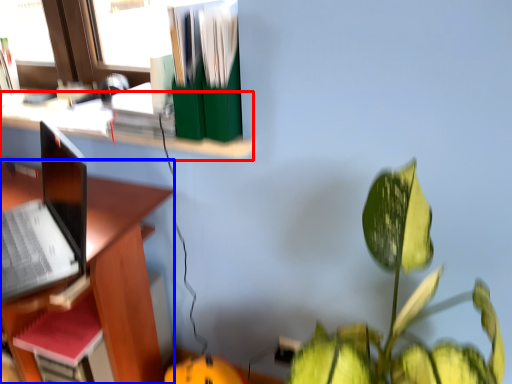
Question: Which object appears farthest to the camera in this image, shelf (highlighted by a red box) or desk (highlighted by a blue box)?

Choices:
 (A) shelf
 (B) desk

Answer: (A)